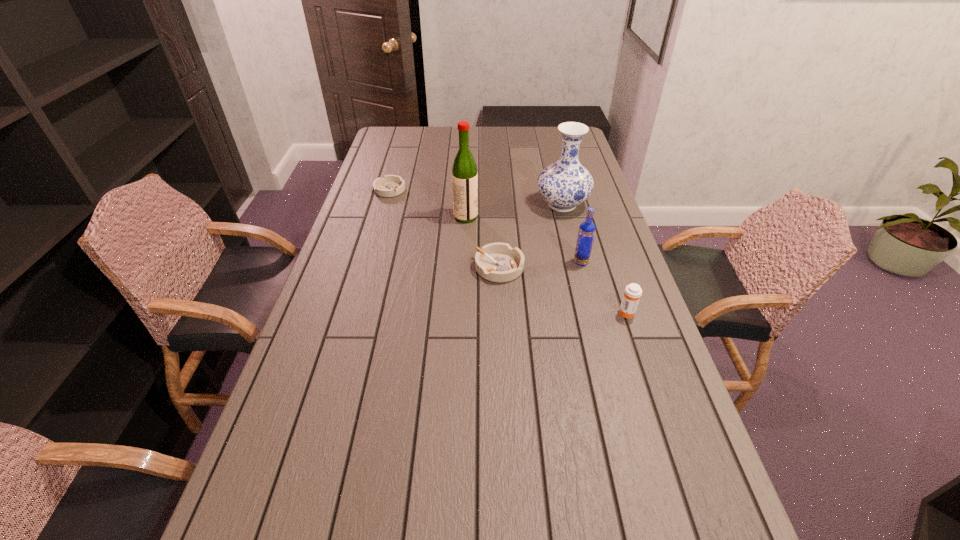
Where is `free spot between the fifth shortest object and the medicine`? This screenshot has width=960, height=540. free spot between the fifth shortest object and the medicine is located at coordinates (594, 259).

Locate an element on the screen. This screenshot has height=540, width=960. vacant space in between the vodka and the farther ashtray is located at coordinates (486, 226).

Locate an element on the screen. The width and height of the screenshot is (960, 540). free space between the taller ashtray and the third tallest object is located at coordinates (540, 265).

What are the coordinates of `vacant area that lies between the nearer ashtray and the vase` in the screenshot? It's located at (531, 236).

Point out which object is positioned as the fifth nearest to the farther ashtray. Please provide its 2D coordinates. Your answer should be formatted as a tuple, i.e. [(x, y)], where the tuple contains the x and y coordinates of a point satisfying the conditions above.

[(632, 293)]

Identify which object is the fourth closest to the right ashtray. Please provide its 2D coordinates. Your answer should be formatted as a tuple, i.e. [(x, y)], where the tuple contains the x and y coordinates of a point satisfying the conditions above.

[(632, 293)]

Where is `free space that satisfies the following two spatial constraints: 1. on the label of the third tallest object; 2. on the left side of the liquor`? The image size is (960, 540). free space that satisfies the following two spatial constraints: 1. on the label of the third tallest object; 2. on the left side of the liquor is located at coordinates (464, 262).

This screenshot has height=540, width=960. Find the location of `blank area in the image that satisfies the following two spatial constraints: 1. on the front side of the shortest object; 2. on the left side of the taller ashtray`. blank area in the image that satisfies the following two spatial constraints: 1. on the front side of the shortest object; 2. on the left side of the taller ashtray is located at coordinates (368, 267).

The image size is (960, 540). Identify the location of free space that satisfies the following two spatial constraints: 1. on the label of the liquor; 2. on the right side of the nearer ashtray. (464, 267).

The height and width of the screenshot is (540, 960). In order to click on free space that satisfies the following two spatial constraints: 1. on the label of the liquor; 2. on the left side of the vodka in this screenshot , I will do `click(464, 262)`.